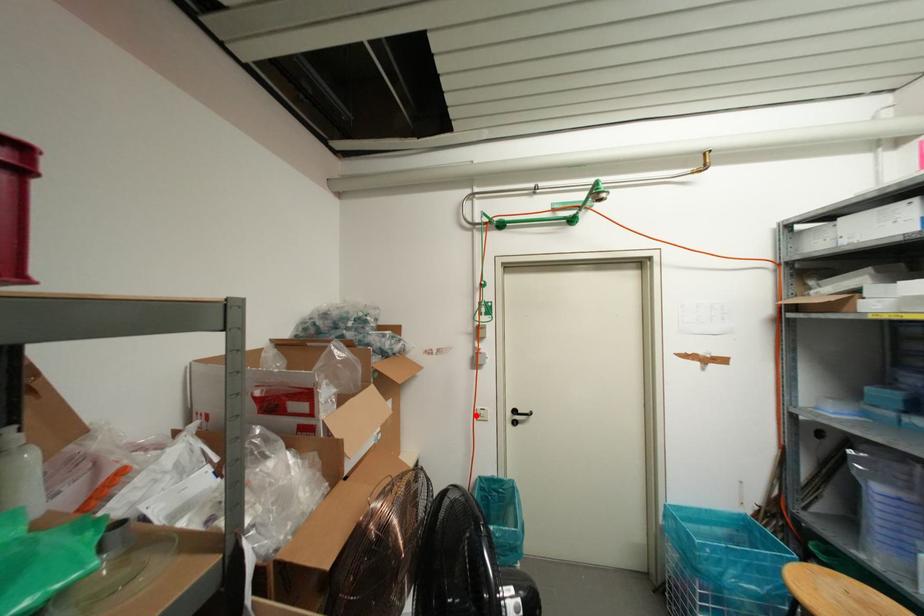
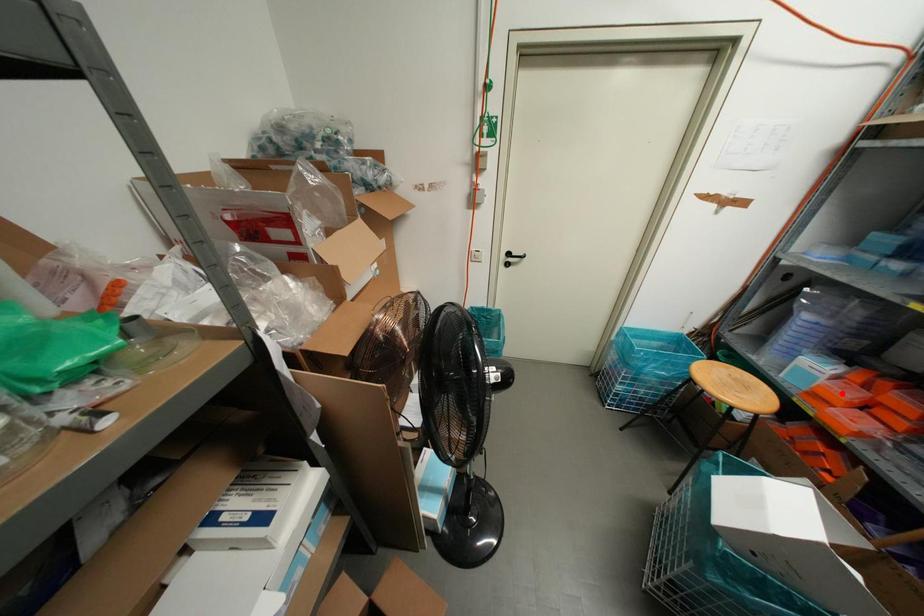
I am providing you with two images of the same scene from different viewpoints. A red point is marked on the first image and another point is marked on the second image. Is the red point in image1 aligned with the point shown in image2?

No